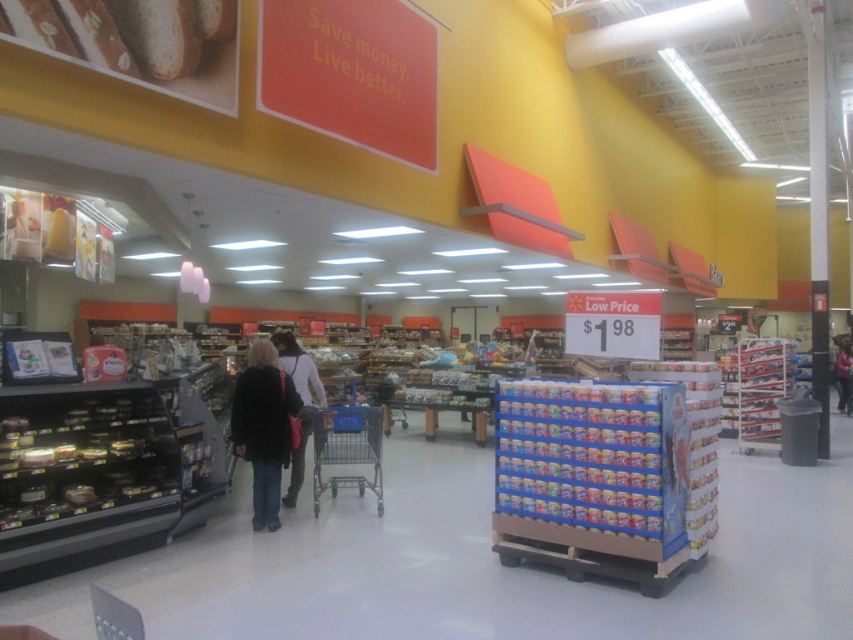
Question: Among these objects, which one is farthest from the camera?

Choices:
 (A) black fabric jacket at center
 (B) blue metal shopping cart at center
 (C) dark brown leather jacket at center

Answer: (C)

Question: Is black fabric jacket at center in front of black fabric purse at center?

Choices:
 (A) yes
 (B) no

Answer: (A)

Question: Which of these objects is positioned closest to the dark brown leather jacket at center?

Choices:
 (A) black fabric jacket at center
 (B) black fabric purse at center
 (C) blue metal shopping cart at center

Answer: (C)

Question: Which of the following is the closest to the observer?

Choices:
 (A) (848, 378)
 (B) (308, 372)
 (C) (251, 413)

Answer: (C)

Question: Is black fabric purse at center closer to the viewer compared to dark brown leather jacket at center?

Choices:
 (A) yes
 (B) no

Answer: (A)

Question: Considering the relative positions of black fabric jacket at center and dark brown leather jacket at center in the image provided, where is black fabric jacket at center located with respect to dark brown leather jacket at center?

Choices:
 (A) left
 (B) right

Answer: (A)